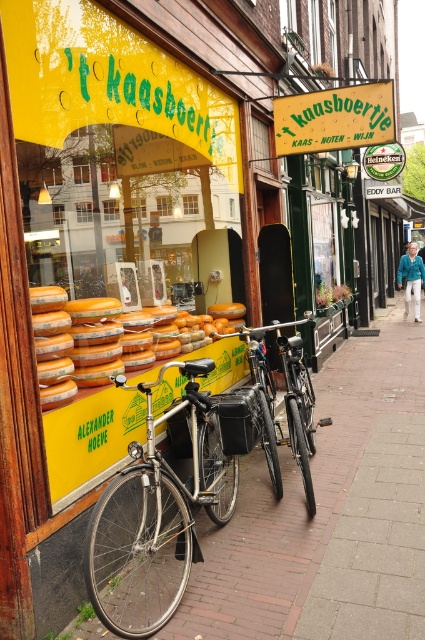
You are a tourist visiting the cheese shop in Amsterdam. You notice the brick pavement at center and the orange cheese at center. Which object is bigger in size?

The brick pavement at center is larger in size compared to the orange cheese at center.

You are a delivery person who needs to choose a bicycle to carry a large cheese wheel from the store. The shiny silver bicycle at center has a basket, while the shiny metallic bicycle at center does not. Which bicycle would you choose based on size and carrying capacity?

The shiny metallic bicycle at center is larger and can carry heavier loads, so you should choose the shiny metallic bicycle at center.